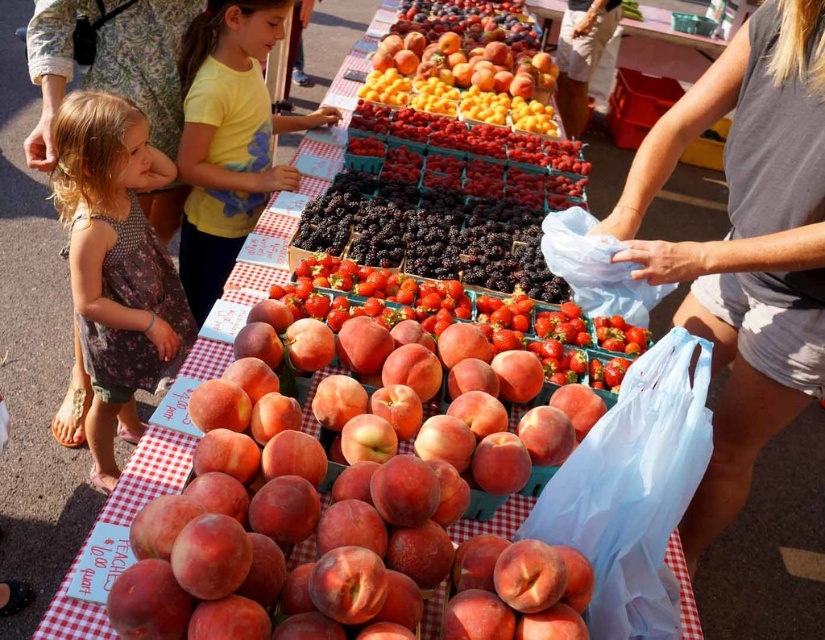
Does matte gray tank top at center come behind glossy yellow apricots at center?

No.

Is matte gray tank top at center positioned before glossy yellow apricots at center?

Yes.

This screenshot has width=825, height=640. In order to click on matte gray tank top at center in this screenshot , I will do `click(746, 243)`.

Is point (229, 51) behind point (371, 60)?

No, it is not.

Is yellow cotton shirt at upper center positioned behind glossy yellow apricots at center?

No, yellow cotton shirt at upper center is in front of glossy yellow apricots at center.

Is point (248, 65) farther from viewer compared to point (408, 77)?

That is False.

Image resolution: width=825 pixels, height=640 pixels. In order to click on yellow cotton shirt at upper center in this screenshot , I will do `click(229, 138)`.

Does floral dress at left appear over glossy yellow apricots at center?

Actually, floral dress at left is below glossy yellow apricots at center.

Does floral dress at left come in front of glossy yellow apricots at center?

Yes, floral dress at left is in front of glossy yellow apricots at center.

The height and width of the screenshot is (640, 825). I want to click on floral dress at left, so click(116, 264).

The image size is (825, 640). I want to click on floral dress at left, so click(116, 264).